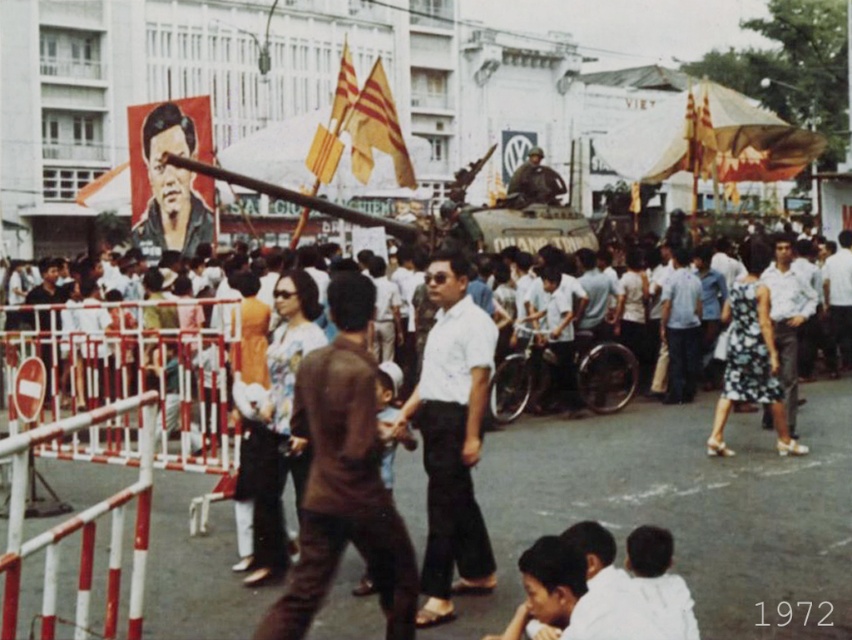
Question: Estimate the real-world distances between objects in this image. Which object is closer to the yellowmaterial/textureflag at upper center?

Choices:
 (A) matte black portrait at upper left
 (B) white matte shirt at center
 (C) camouflage fabric soldier at center

Answer: (C)

Question: Can you confirm if brown matte shirt at center is positioned to the right of yellow fabric flag at center?

Choices:
 (A) yes
 (B) no

Answer: (A)

Question: Does green camouflage tank at center appear on the right side of yellow fabric flag at center?

Choices:
 (A) no
 (B) yes

Answer: (B)

Question: Which object appears closest to the camera in this image?

Choices:
 (A) yellow fabric flag at center
 (B) brown matte shirt at center

Answer: (B)

Question: Which object appears farthest from the camera in this image?

Choices:
 (A) green camouflage tank at center
 (B) brown matte shirt at center
 (C) matte black portrait at upper left

Answer: (C)

Question: Is green camouflage tank at center smaller than yellowmaterial/textureflag at upper center?

Choices:
 (A) yes
 (B) no

Answer: (B)